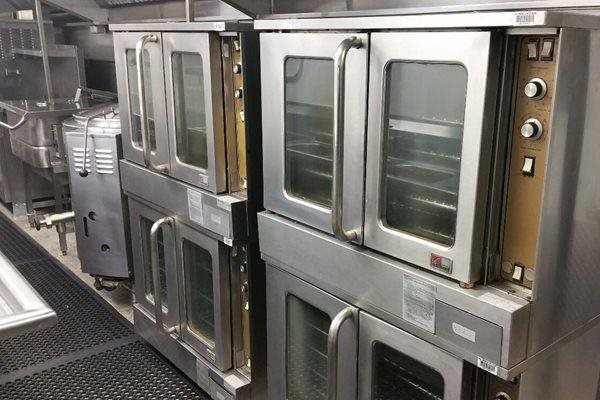
The image size is (600, 400). Find the location of `upper control knobs`. upper control knobs is located at coordinates (535, 88), (235, 68), (241, 268), (503, 393).